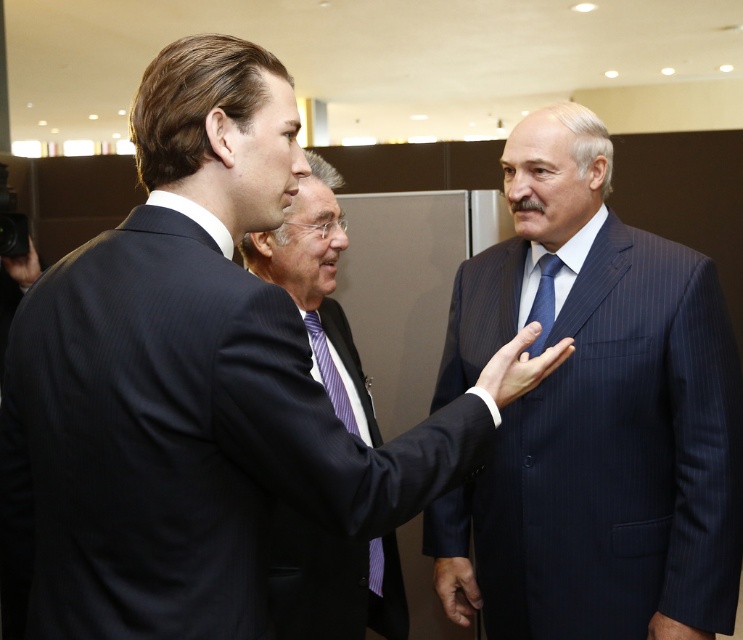
Does purple striped tie at center have a greater width compared to black smooth hand at lower right?

Yes, purple striped tie at center is wider than black smooth hand at lower right.

The width and height of the screenshot is (743, 640). What are the coordinates of `purple striped tie at center` in the screenshot? It's located at (328, 372).

This screenshot has height=640, width=743. What do you see at coordinates (328, 372) in the screenshot?
I see `purple striped tie at center` at bounding box center [328, 372].

This screenshot has height=640, width=743. Find the location of `purple striped tie at center`. purple striped tie at center is located at coordinates (328, 372).

I want to click on blue pinstripe suit at center, so click(597, 413).

Measure the distance between blue pinstripe suit at center and blue silk tie at center.

blue pinstripe suit at center is 10.12 inches from blue silk tie at center.

Locate an element on the screen. This screenshot has height=640, width=743. blue pinstripe suit at center is located at coordinates (597, 413).

Does blue pinstripe suit at center have a lesser height compared to dark blue suit at center?

In fact, blue pinstripe suit at center may be taller than dark blue suit at center.

Does blue pinstripe suit at center have a greater width compared to dark blue suit at center?

Correct, the width of blue pinstripe suit at center exceeds that of dark blue suit at center.

Who is more forward, (499, 586) or (374, 563)?

Point (374, 563) is in front.

This screenshot has width=743, height=640. What are the coordinates of `blue pinstripe suit at center` in the screenshot? It's located at (597, 413).